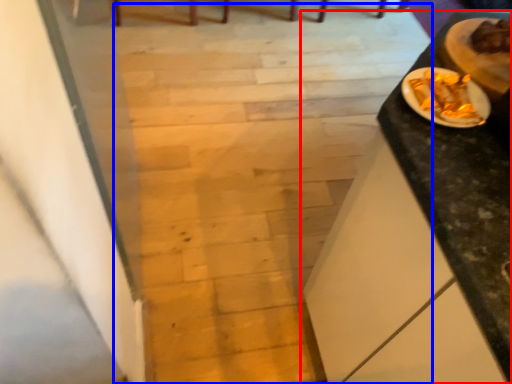
Question: Which object is closer to the camera taking this photo, table (highlighted by a red box) or stairwell (highlighted by a blue box)?

Choices:
 (A) table
 (B) stairwell

Answer: (A)